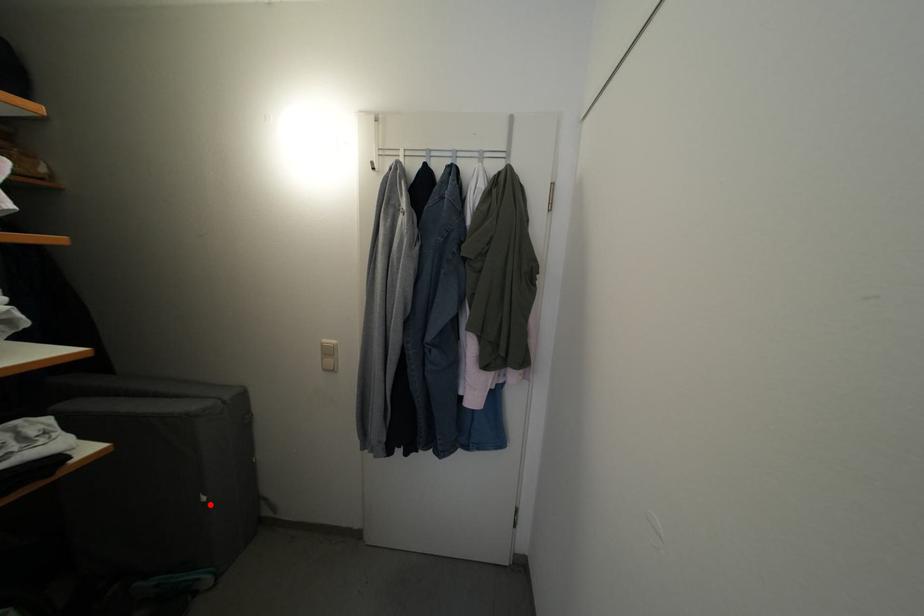
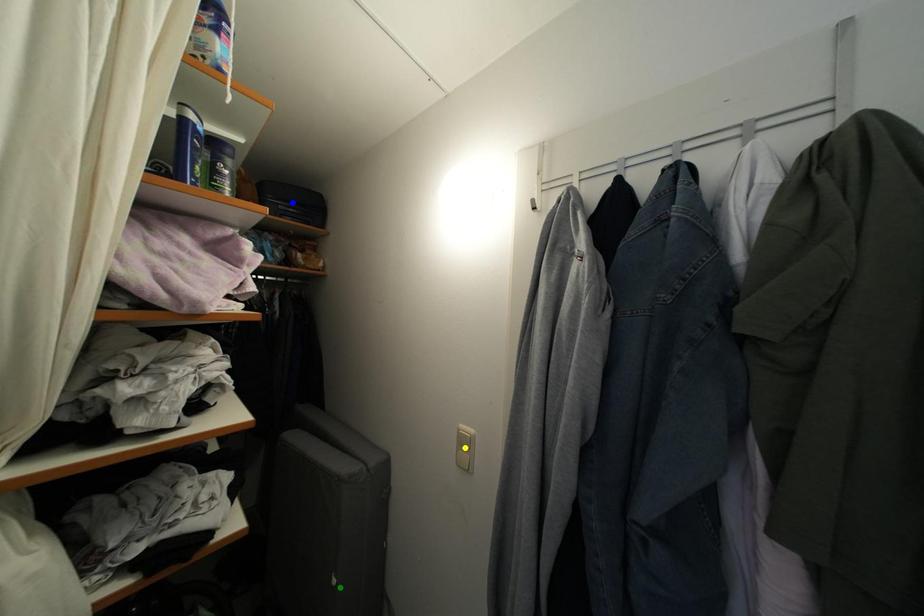
Question: I am providing you with two images of the same scene from different viewpoints. A red point is marked on the first image. You are given multiple points on the second image. Can you choose the point in image 2 that corresponds to the point in image 1?

Choices:
 (A) green point
 (B) blue point
 (C) yellow point

Answer: (A)